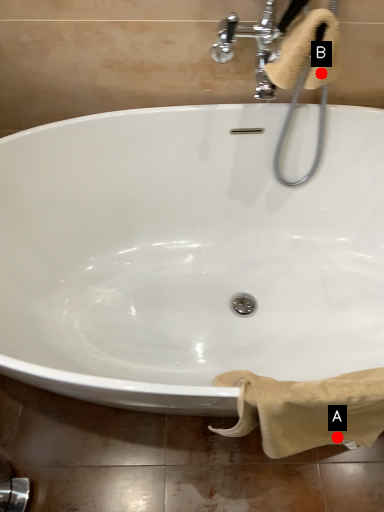
Question: Two points are circled on the image, labeled by A and B beside each circle. Which of the following is the farthest from the observer?

Choices:
 (A) A is further
 (B) B is further

Answer: (A)